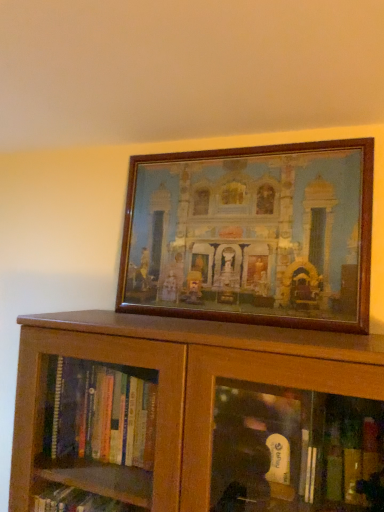
The width and height of the screenshot is (384, 512). What are the coordinates of `wooden picture frame at upper center` in the screenshot? It's located at (252, 234).

Describe the element at coordinates (252, 234) in the screenshot. I see `wooden picture frame at upper center` at that location.

What is the approximate width of wooden picture frame at upper center?

It is 2.00 inches.

Where is `wooden picture frame at upper center`? wooden picture frame at upper center is located at coordinates (252, 234).